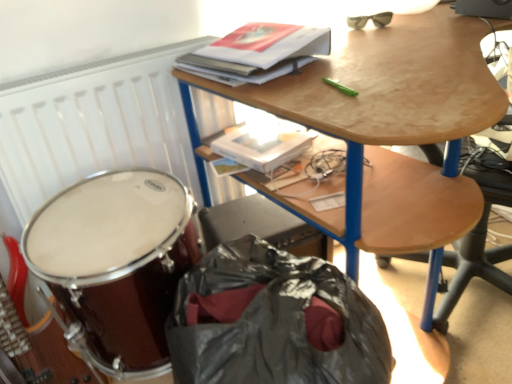
Image resolution: width=512 pixels, height=384 pixels. Identify the location of shiny black handbag at lower left. (274, 321).

Where is `wooden desk at upper center`? The image size is (512, 384). wooden desk at upper center is located at coordinates (386, 130).

Where is `shiny brown drum at lower left`? The width and height of the screenshot is (512, 384). shiny brown drum at lower left is located at coordinates (117, 261).

This screenshot has width=512, height=384. What are the coordinates of `matte black sunglasses at upper right` in the screenshot? It's located at (370, 19).

At what (x,y) coordinates should I click in order to perform the action: click on shiny black handbag at lower left. Please return your answer as a coordinate pair (x, y). The height and width of the screenshot is (384, 512). Looking at the image, I should click on [x=274, y=321].

Find the location of a particular element. The image size is (512, 384). paperback book positioned vertically above the wooden desk at upper center (from a real-world perspective) is located at coordinates (268, 44).

Is wooden desk at upper center touching hardcover book at upper center?

No, wooden desk at upper center is not in contact with hardcover book at upper center.

Which object is more forward, hardcover book at upper center or shiny brown drum at lower left?

shiny brown drum at lower left is closer to the camera.

Is point (251, 65) farther from viewer compared to point (82, 324)?

No, it is not.

In terms of width, does hardcover book at upper center look wider or thinner when compared to shiny brown drum at lower left?

Considering their sizes, hardcover book at upper center looks slimmer than shiny brown drum at lower left.

In the image, is shiny black handbag at lower left positioned in front of or behind wooden desk at upper center?

Clearly, shiny black handbag at lower left is in front of wooden desk at upper center.

From a real-world perspective, does shiny black handbag at lower left sit lower than wooden desk at upper center?

Indeed, from a real-world perspective, shiny black handbag at lower left is positioned beneath wooden desk at upper center.

The image size is (512, 384). What are the coordinates of `desk on the right of the shiny black handbag at lower left` in the screenshot? It's located at (386, 130).

From the image's perspective, is shiny black handbag at lower left above or below wooden desk at upper center?

Clearly, from the image's perspective, shiny black handbag at lower left is below wooden desk at upper center.

Can you confirm if matte black sunglasses at upper right is positioned to the right of hardcover book at upper center?

Yes.

Is matte black sunglasses at upper right thinner than hardcover book at upper center?

Yes.

From a real-world perspective, is matte black sunglasses at upper right under hardcover book at upper center?

Correct, in the physical world, matte black sunglasses at upper right is lower than hardcover book at upper center.

From the image's perspective, is matte black sunglasses at upper right located above hardcover book at upper center?

Yes.

Which is farther from the camera, (x=366, y=214) or (x=367, y=18)?

Positioned behind is point (x=367, y=18).

Between wooden desk at upper center and matte black sunglasses at upper right, which one appears on the left side from the viewer's perspective?

matte black sunglasses at upper right is more to the left.

From a real-world perspective, is wooden desk at upper center physically above matte black sunglasses at upper right?

Actually, wooden desk at upper center is physically below matte black sunglasses at upper right in the real world.

From the image's perspective, is hardcover book at upper center located above or below white matte radiator at upper left?

hardcover book at upper center is above white matte radiator at upper left.

Is hardcover book at upper center taller than white matte radiator at upper left?

Incorrect, the height of hardcover book at upper center is not larger of that of white matte radiator at upper left.

Is hardcover book at upper center located outside matte black sunglasses at upper right?

hardcover book at upper center lies outside matte black sunglasses at upper right's area.

Considering the points (270, 39) and (362, 23), which point is behind, point (270, 39) or point (362, 23)?

The point (362, 23) is farther.

Between hardcover book at upper center and matte black sunglasses at upper right, which one has more height?

With more height is hardcover book at upper center.

At what (x,y) coordinates should I click in order to perform the action: click on glasses on the right side of hardcover book at upper center. Please return your answer as a coordinate pair (x, y). This screenshot has height=384, width=512. Looking at the image, I should click on (370, 19).

The width and height of the screenshot is (512, 384). I want to click on desk in front of the hardcover book at upper center, so click(386, 130).

This screenshot has width=512, height=384. I want to click on paperback book above the shiny brown drum at lower left (from the image's perspective), so click(x=268, y=44).

Estimate the real-world distances between objects in this image. Which object is closer to shiny brown drum at lower left, wooden desk at upper center or hardcover book at upper center?

Based on the image, wooden desk at upper center appears to be nearer to shiny brown drum at lower left.

Which object lies nearer to the anchor point wooden desk at upper center, white matte radiator at upper left or shiny brown drum at lower left?

white matte radiator at upper left.

Looking at this image, estimate the real-world distances between objects in this image. Which object is further from wooden desk at upper center, shiny brown drum at lower left or matte black sunglasses at upper right?

Based on the image, matte black sunglasses at upper right appears to be further to wooden desk at upper center.

When comparing their distances from hardcover book at upper center, does matte black sunglasses at upper right or white matte radiator at upper left seem closer?

Among the two, white matte radiator at upper left is located nearer to hardcover book at upper center.

Based on their spatial positions, is matte black sunglasses at upper right or shiny black handbag at lower left further from wooden desk at upper center?

The object further to wooden desk at upper center is matte black sunglasses at upper right.

When comparing their distances from white matte radiator at upper left, does shiny brown drum at lower left or wooden desk at upper center seem closer?

shiny brown drum at lower left lies closer to white matte radiator at upper left than the other object.

Which object lies nearer to the anchor point wooden desk at upper center, matte black sunglasses at upper right or shiny brown drum at lower left?

shiny brown drum at lower left lies closer to wooden desk at upper center than the other object.

Considering their positions, is wooden desk at upper center positioned closer to shiny black handbag at lower left than white matte radiator at upper left?

Among the two, wooden desk at upper center is located nearer to shiny black handbag at lower left.

This screenshot has height=384, width=512. I want to click on paperback book between wooden desk at upper center and matte black sunglasses at upper right in the front-back direction, so click(x=268, y=44).

This screenshot has height=384, width=512. In order to click on glasses located between white matte radiator at upper left and wooden desk at upper center in the left-right direction in this screenshot , I will do click(370, 19).

Find the location of a particular element. The height and width of the screenshot is (384, 512). paperback book between white matte radiator at upper left and wooden desk at upper center is located at coordinates (268, 44).

Locate an element on the screen. The image size is (512, 384). drum between white matte radiator at upper left and shiny black handbag at lower left vertically is located at coordinates (117, 261).